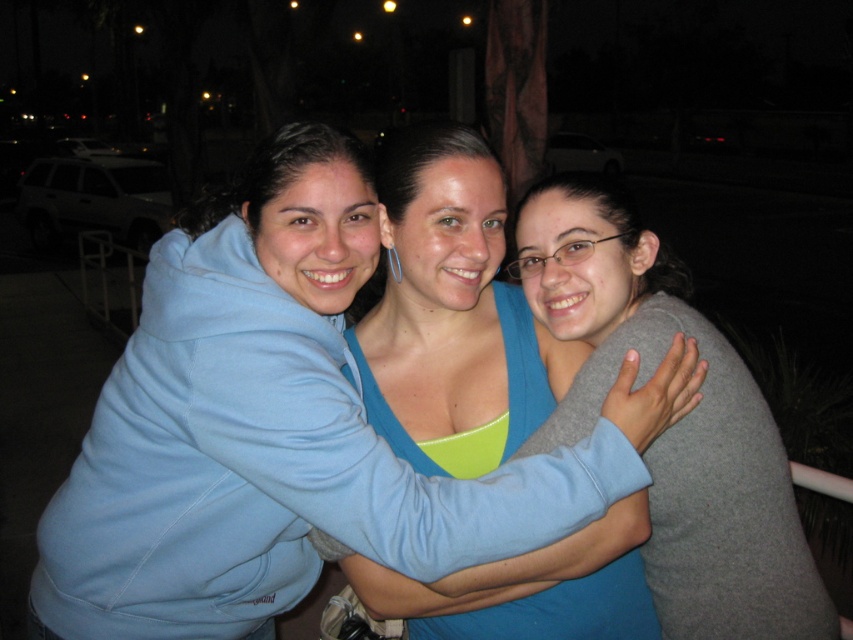
In the scene shown: You are a photographer trying to focus on the blue fabric top at center and the gray matte sweater at center. Which one is positioned lower in the image?

The blue fabric top at center is below gray matte sweater at center, so the blue fabric top at center is positioned lower in the image.

Based on the photo, you are trying to locate the blue fabric top at center in the image. According to the coordinates provided, where exactly is it positioned?

The blue fabric top at center is located at point coordinates 0.489 on the x axis and 0.531 on the y axis.

You are a photographer trying to capture a photo of the blue fabric top at center and the gray matte sweater at center. From which side of the two should you position yourself to ensure both are fully visible in the frame?

To ensure both the blue fabric top at center and the gray matte sweater at center are fully visible in the frame, position yourself to the right side of the blue fabric top at center and the gray matte sweater at center since the blue fabric top at center is to the left of the gray matte sweater at center.